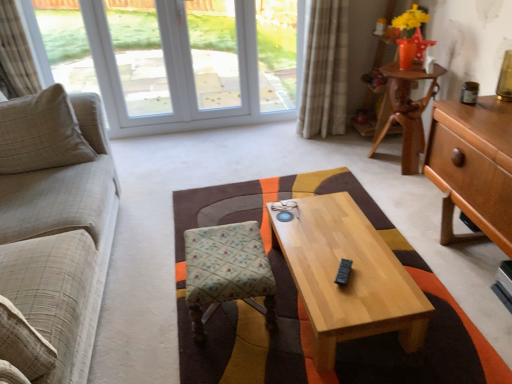
In order to click on vacant area to the right of light wood/texture coffee table at center in this screenshot , I will do `click(439, 285)`.